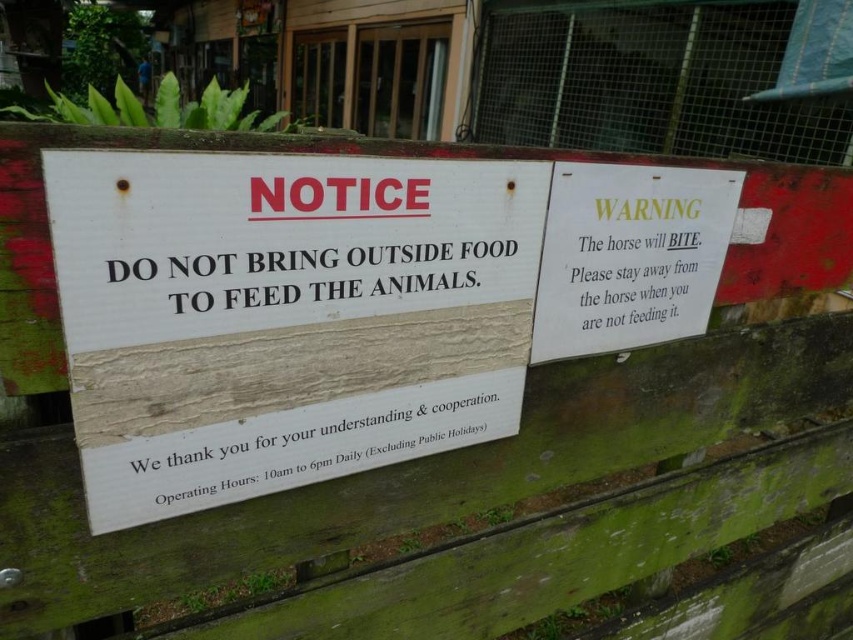
Question: Which of the following is the farthest from the observer?

Choices:
 (A) white paper warning at upper right
 (B) white wood sign at upper left

Answer: (A)

Question: Is white wood sign at upper left below white paper warning at upper right?

Choices:
 (A) no
 (B) yes

Answer: (B)

Question: Is white wood sign at upper left bigger than white paper warning at upper right?

Choices:
 (A) no
 (B) yes

Answer: (B)

Question: From the image, what is the correct spatial relationship of white wood sign at upper left in relation to white paper warning at upper right?

Choices:
 (A) right
 (B) left

Answer: (B)

Question: Which point is farther from the camera taking this photo?

Choices:
 (A) (225, 440)
 (B) (706, 200)

Answer: (B)